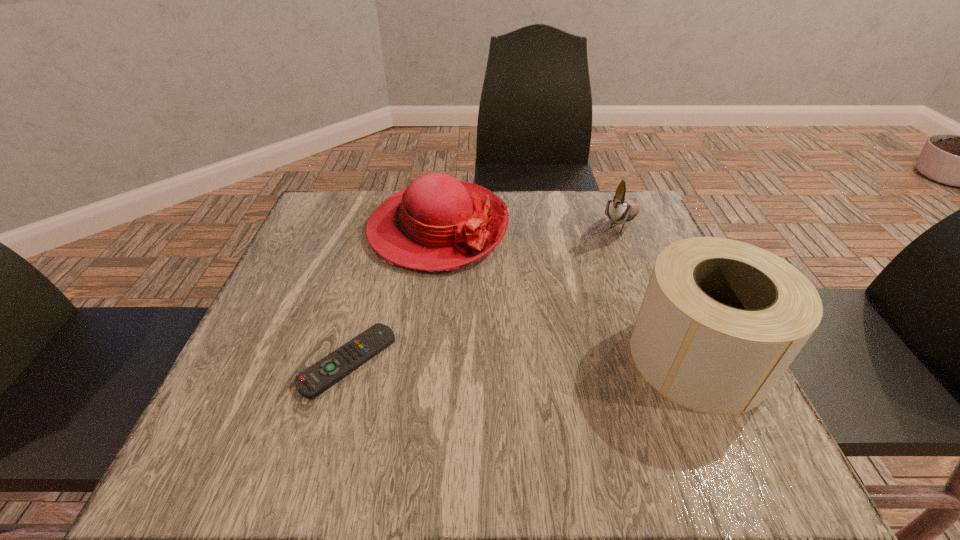
Where is `free space that is in between the shortest object and the second shortest object`? free space that is in between the shortest object and the second shortest object is located at coordinates (393, 295).

Find the location of a particular element. unoccupied area between the shortest object and the hat is located at coordinates (393, 295).

You are a GUI agent. You are given a task and a screenshot of the screen. Output one action in this format:
    pyautogui.click(x=<x>, y=<y>)
    Task: Click on the vacant space that is in between the hat and the shortest object
    The width and height of the screenshot is (960, 540).
    Given the screenshot: What is the action you would take?
    pyautogui.click(x=393, y=295)

This screenshot has height=540, width=960. Identify the location of free spot between the hat and the bird. (529, 226).

This screenshot has width=960, height=540. In order to click on free space between the bird and the third tallest object in this screenshot , I will do `click(529, 226)`.

This screenshot has width=960, height=540. I want to click on free space between the shortest object and the hat, so click(393, 295).

This screenshot has width=960, height=540. I want to click on vacant area that lies between the toilet tissue and the hat, so click(x=567, y=293).

Where is `free space between the bird and the hat`? free space between the bird and the hat is located at coordinates (529, 226).

Image resolution: width=960 pixels, height=540 pixels. I want to click on the closest object relative to the toilet tissue, so (619, 210).

Select which object appears as the second closest to the bird. Please provide its 2D coordinates. Your answer should be formatted as a tuple, i.e. [(x, y)], where the tuple contains the x and y coordinates of a point satisfying the conditions above.

[(437, 223)]